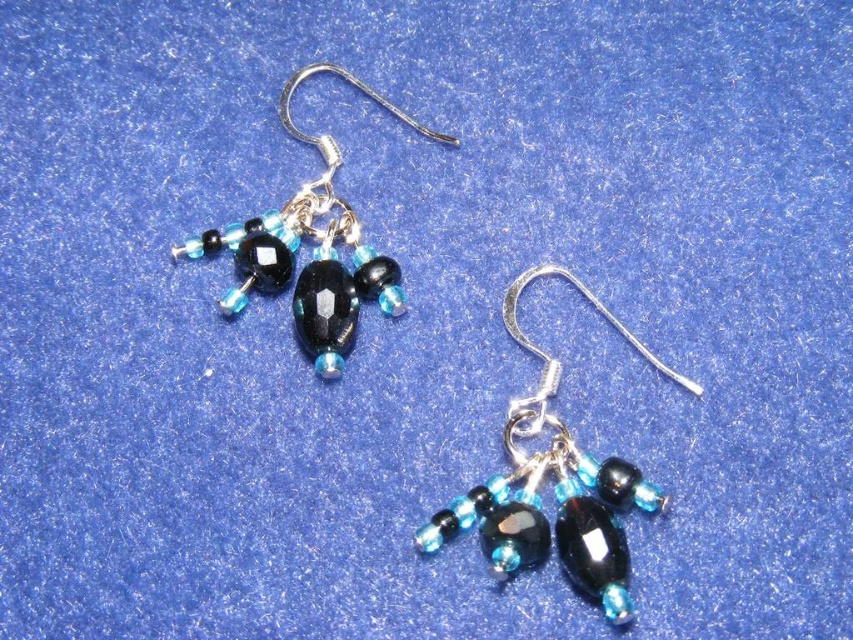
Question: Which object appears farthest from the camera in this image?

Choices:
 (A) matte black glass bead at center
 (B) matte black bead at upper left

Answer: (B)

Question: Does matte black glass bead at center appear under matte black bead at upper left?

Choices:
 (A) yes
 (B) no

Answer: (A)

Question: Can you confirm if matte black glass bead at center is smaller than matte black bead at upper left?

Choices:
 (A) no
 (B) yes

Answer: (A)

Question: Does matte black glass bead at center have a lesser width compared to matte black bead at upper left?

Choices:
 (A) no
 (B) yes

Answer: (B)

Question: Which of the following is the closest to the observer?

Choices:
 (A) matte black glass bead at center
 (B) matte black bead at upper left

Answer: (A)